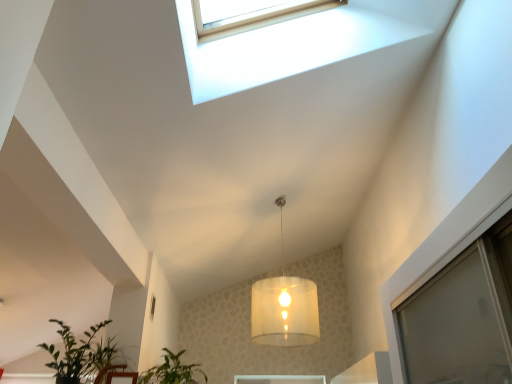
Question: Looking at the image, does translucent fabric lampshade at center seem bigger or smaller compared to green leafy plant at lower left, the first houseplant viewed from the left?

Choices:
 (A) small
 (B) big

Answer: (B)

Question: From the image's perspective, relative to green leafy plant at lower left, which is counted as the 2th houseplant, starting from the right, is translucent fabric lampshade at center above or below?

Choices:
 (A) below
 (B) above

Answer: (B)

Question: Estimate the real-world distances between objects in this image. Which object is farther from the translucent fabric lampshade at center?

Choices:
 (A) green leafy plant at lower left, the first houseplant viewed from the left
 (B) green leafy plant at lower center, which ranks as the 2th houseplant in left-to-right order

Answer: (A)

Question: Which is nearer to the translucent fabric lampshade at center?

Choices:
 (A) green leafy plant at lower center, the first houseplant in the right-to-left sequence
 (B) green leafy plant at lower left, which is counted as the 2th houseplant, starting from the right

Answer: (A)